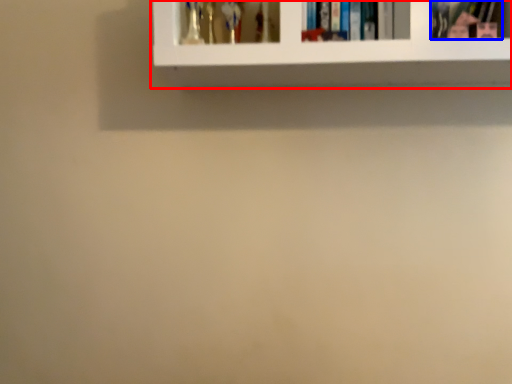
Question: Which of the following is the farthest to the observer, shelf (highlighted by a red box) or book (highlighted by a blue box)?

Choices:
 (A) shelf
 (B) book

Answer: (B)